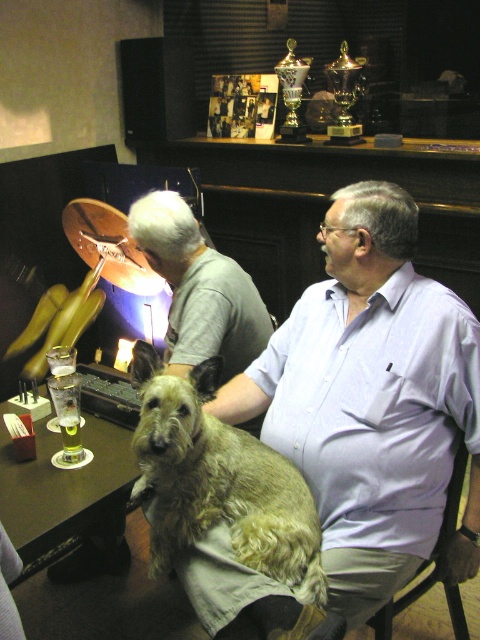
You are a photographer standing in front of the table. You want to take a photo of the fuzzy brown dog at center and the gray cotton shirt at center. Which object should you focus on first if you want to capture both in the same frame without moving the camera?

The gray cotton shirt at center is taller than the fuzzy brown dog at center, so focusing on the gray cotton shirt at center first will ensure both objects are in focus since it is the taller object.

You are a bartender who needs to place a new green glass at point (64, 492). According to the scene description, where should you place the green glass?

The green glass should be placed at the lower left of the table since the point (64, 492) corresponds to the green glass at lower left.